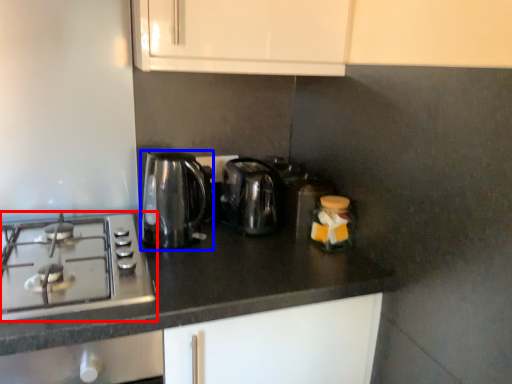
Question: Which object is further to the camera taking this photo, gas stove (highlighted by a red box) or kitchen appliance (highlighted by a blue box)?

Choices:
 (A) gas stove
 (B) kitchen appliance

Answer: (B)